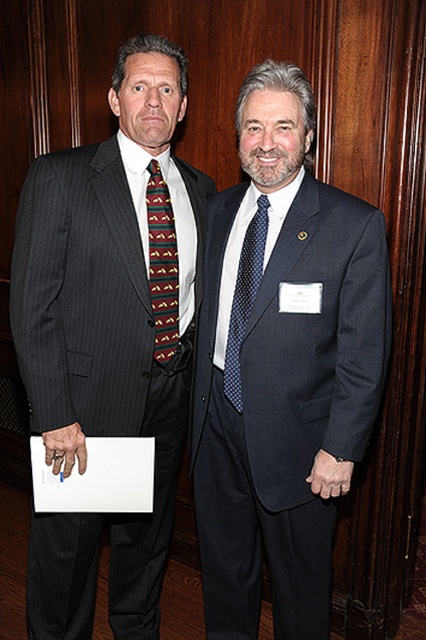
From the picture: You are standing in a room with two men. You need to locate the dark blue textured suit at center. Where would you find it in relation to the other objects in the scene?

The dark blue textured suit at center is located at the coordinates point (282, 368).

You are a photographer setting up for a professional photoshoot. You need to ensure that both the dark blue textured suit at center and the blue dotted tie at center are clearly visible in the frame. Based on their positions, which one should you focus on first to ensure it is in sharp focus?

The dark blue textured suit at center should be focused on first since it is in front of the blue dotted tie at center, meaning it will be closer to the camera and thus easier to keep in sharp focus.

You are a fashion designer observing two men in the image. The men are wearing a pinstriped suit at left and a blue dotted tie at center. Which of these two items is bigger in size?

The pinstriped suit at left is larger in size than the blue dotted tie at center.